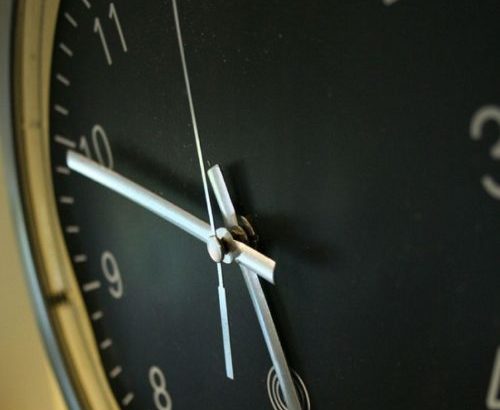
Locate an element on the screen. Image resolution: width=500 pixels, height=410 pixels. clock minute hand is located at coordinates (189, 223).